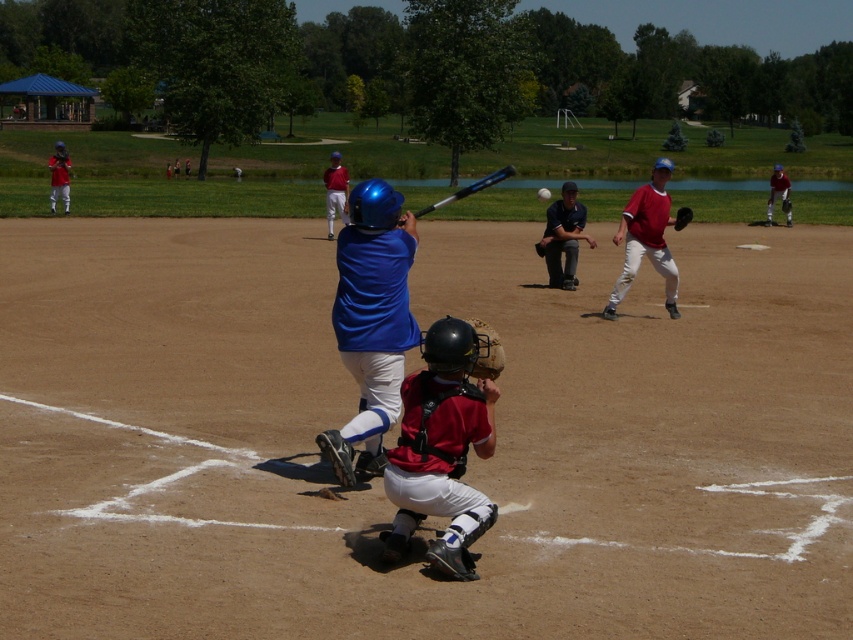
You are a coach standing at the edge of the field. You need to quickly retrieve an item from either the matte blue helmet at center or the dark blue uniform at center. Which one can you reach faster?

The matte blue helmet at center is 8.06 meters away from the dark blue uniform at center. Since both items are at the center of the field, their distance from the coach at the edge would depend on the coach position. However, without knowing the exact coach position, it is impossible to determine which is closer.

You are a spectator at the baseball game and want to take a photo of both the matte blue helmet at center and the matte blue helmet at upper center. Which helmet should you focus on first to ensure both are in the frame?

You should focus on the matte blue helmet at center first because it is in front of the matte blue helmet at upper center, so adjusting the camera to include both would require ensuring the foreground helmet is properly framed before accounting for the background one.

You are a coach observing the baseball game. You notice the matte blue helmet at center and the dark blue uniform at center. Which one is positioned closer to the home plate?

The matte blue helmet at center is in front of the dark blue uniform at center, so the matte blue helmet at center is closer to the home plate.